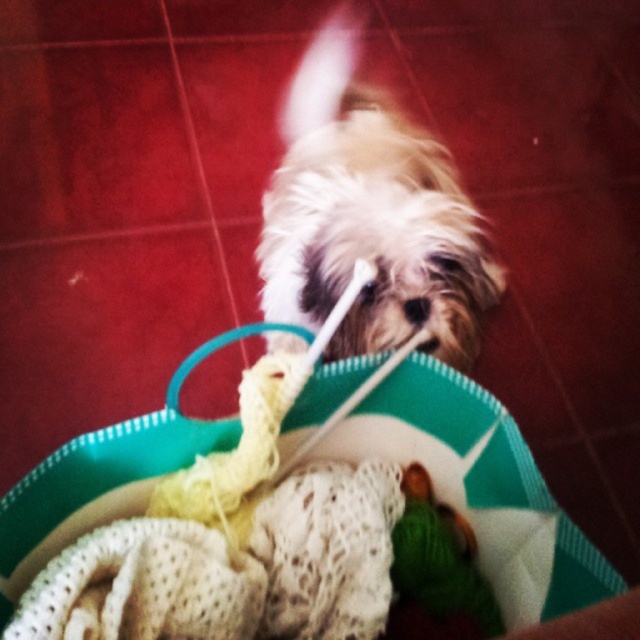
Question: Is the position of fluffy white fur at center less distant than that of green fabric toy at center?

Choices:
 (A) yes
 (B) no

Answer: (A)

Question: Which is farther from the fluffy white fur at center?

Choices:
 (A) green fabric toy at center
 (B) white knitted blanket at center

Answer: (A)

Question: Which object is farther from the camera taking this photo?

Choices:
 (A) fluffy white fur at center
 (B) green fabric toy at center

Answer: (B)

Question: Can you confirm if fluffy white fur at center is positioned to the right of white knitted blanket at center?

Choices:
 (A) yes
 (B) no

Answer: (A)

Question: Can you confirm if fluffy white fur at center is bigger than green fabric toy at center?

Choices:
 (A) yes
 (B) no

Answer: (A)

Question: Which of the following is the closest to the observer?

Choices:
 (A) white knitted blanket at center
 (B) green fabric toy at center

Answer: (A)